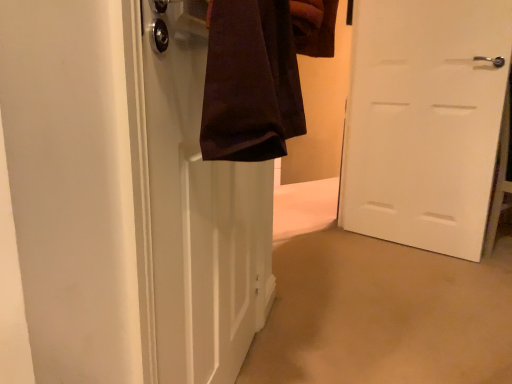
Question: Should I look upward or downward to see white matte door at center?

Choices:
 (A) up
 (B) down

Answer: (A)